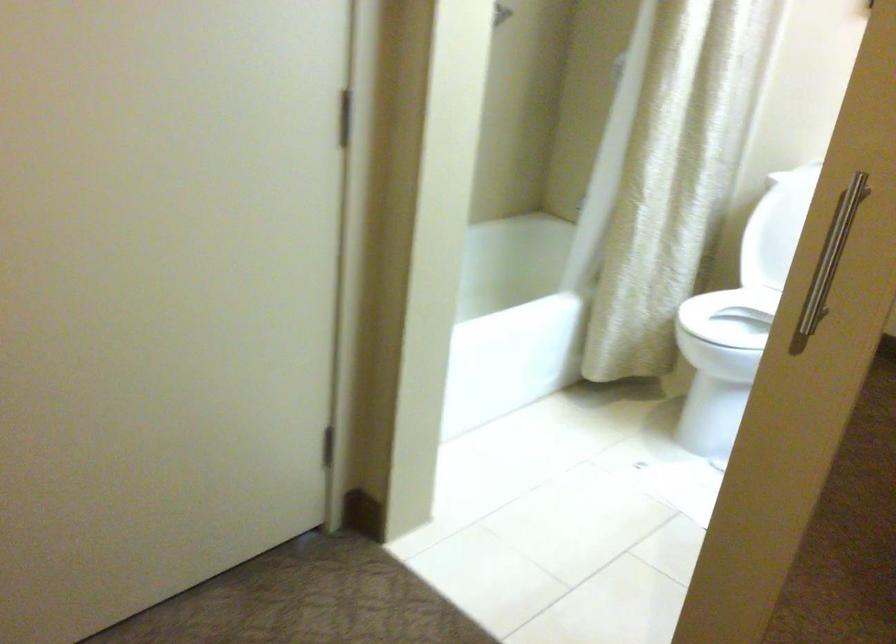
What do you see at coordinates (737, 327) in the screenshot? I see `the white toilet seat` at bounding box center [737, 327].